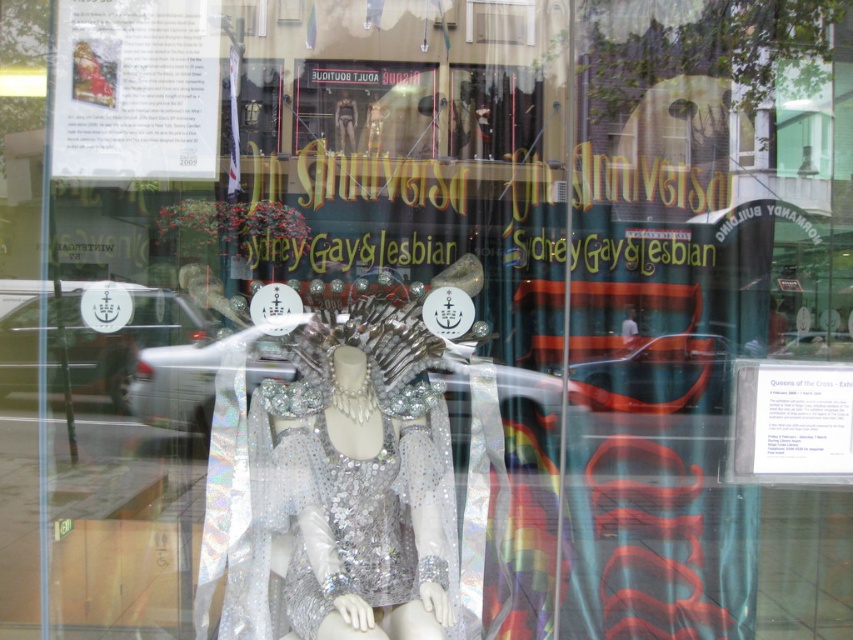
Can you confirm if holographic sequined dress at center is wider than sparkly silver dress at center?

Yes, holographic sequined dress at center is wider than sparkly silver dress at center.

Between point (398, 468) and point (311, 438), which one is positioned behind?

The point (398, 468) is more distant.

The width and height of the screenshot is (853, 640). I want to click on holographic sequined dress at center, so click(x=339, y=483).